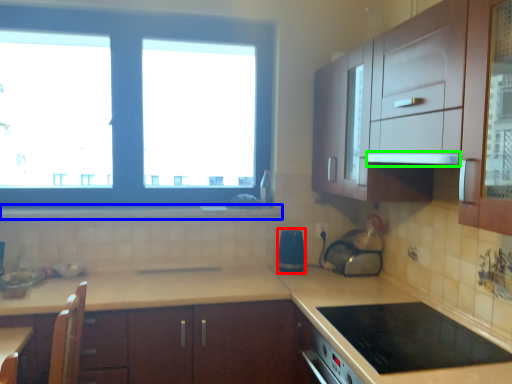
Question: Considering the real-world distances, which object is closest to appliance (highlighted by a red box)? window sill (highlighted by a blue box) or exhaust hood (highlighted by a green box).

Choices:
 (A) window sill
 (B) exhaust hood

Answer: (A)